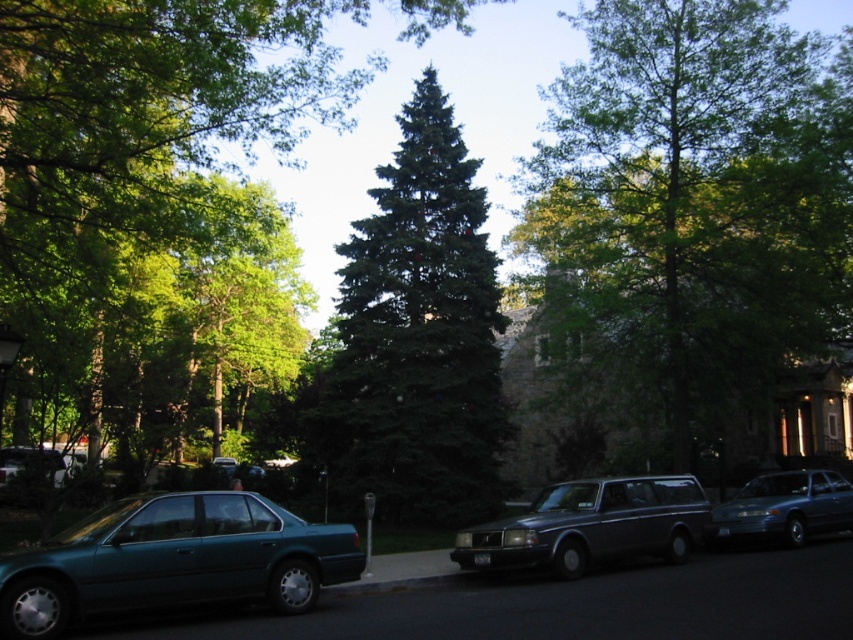
Is point (42, 92) closer to viewer compared to point (32, 449)?

Yes.

Does point (190, 225) come behind point (30, 451)?

That is False.

Does point (120, 84) lie behind point (18, 472)?

No, (120, 84) is closer to viewer.

This screenshot has width=853, height=640. What are the coordinates of `green textured tree at center` in the screenshot? It's located at (143, 109).

From the picture: Which is above, metallic gray station wagon at center or metallic teal sedan at lower left?

metallic teal sedan at lower left is higher up.

Is metallic gray station wagon at center wider than metallic teal sedan at lower left?

No.

Is point (583, 508) farther from camera compared to point (25, 458)?

No, it is in front of (25, 458).

You are a GUI agent. You are given a task and a screenshot of the screen. Output one action in this format:
    pyautogui.click(x=<x>, y=<y>)
    Task: Click on the metallic gray station wagon at center
    
    Given the screenshot: What is the action you would take?
    pyautogui.click(x=590, y=525)

Is green needle-like at center closer to the viewer compared to metallic gray station wagon at center?

That is False.

Can you confirm if green needle-like at center is positioned below metallic gray station wagon at center?

Actually, green needle-like at center is above metallic gray station wagon at center.

The height and width of the screenshot is (640, 853). What do you see at coordinates (416, 337) in the screenshot?
I see `green needle-like at center` at bounding box center [416, 337].

The height and width of the screenshot is (640, 853). What are the coordinates of `green needle-like at center` in the screenshot? It's located at (416, 337).